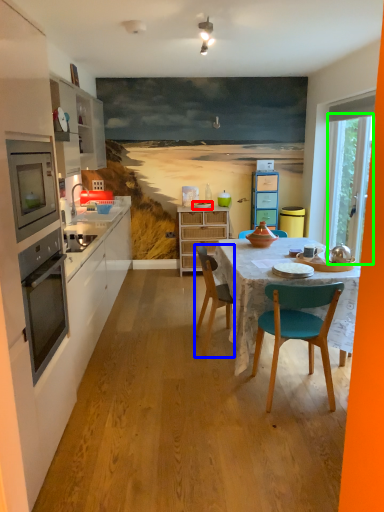
Question: Based on their relative distances, which object is farther from plate (highlighted by a red box)? Choose from chair (highlighted by a blue box) and glass door (highlighted by a green box).

Choices:
 (A) chair
 (B) glass door

Answer: (A)